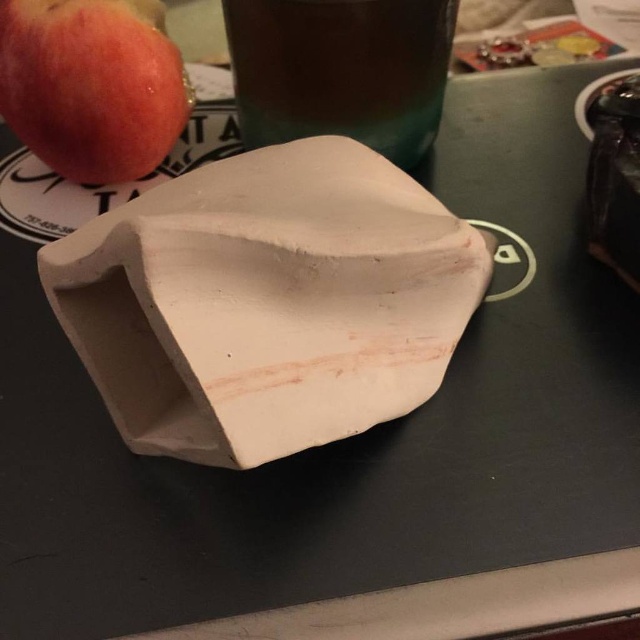
Question: Which point is closer to the camera?

Choices:
 (A) (97, 61)
 (B) (294, 54)

Answer: (A)

Question: Among these objects, which one is nearest to the camera?

Choices:
 (A) translucent glass beverage at upper center
 (B) white clay vase at center
 (C) matte red apple at upper left

Answer: (B)

Question: Can you confirm if translucent glass beverage at upper center is smaller than matte red apple at upper left?

Choices:
 (A) yes
 (B) no

Answer: (B)

Question: Among these objects, which one is farthest from the camera?

Choices:
 (A) matte red apple at upper left
 (B) translucent glass beverage at upper center

Answer: (B)

Question: Does white clay vase at center appear on the left side of translucent glass beverage at upper center?

Choices:
 (A) yes
 (B) no

Answer: (A)

Question: Is white clay vase at center bigger than translucent glass beverage at upper center?

Choices:
 (A) yes
 (B) no

Answer: (A)